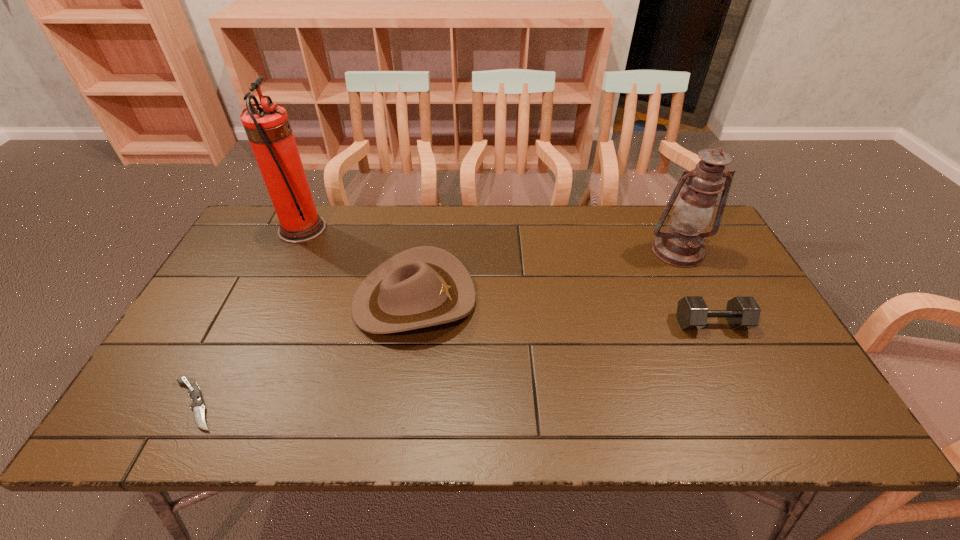
Where is `the tallest object`? the tallest object is located at coordinates (267, 126).

Locate an element on the screen. The height and width of the screenshot is (540, 960). the second tallest object is located at coordinates (681, 245).

Where is `the third object from right to left`? the third object from right to left is located at coordinates (424, 286).

Where is `cowboy hat`? The height and width of the screenshot is (540, 960). cowboy hat is located at coordinates (424, 286).

You are a GUI agent. You are given a task and a screenshot of the screen. Output one action in this format:
    pyautogui.click(x=<x>, y=<y>)
    Task: Click on the second shortest object
    The height and width of the screenshot is (540, 960).
    Given the screenshot: What is the action you would take?
    pyautogui.click(x=742, y=312)

The width and height of the screenshot is (960, 540). In order to click on pocketknife in this screenshot , I will do `click(197, 405)`.

Find the location of a particular element. the nearest object is located at coordinates (197, 405).

The width and height of the screenshot is (960, 540). In order to click on blank area located 0.060m at the discharge end of the fire extinguisher in this screenshot , I will do `click(344, 229)`.

I want to click on free spot located on the left of the second tallest object, so (x=628, y=251).

In order to click on free region located with a star on the front of the third object from right to left in this screenshot , I will do `click(523, 300)`.